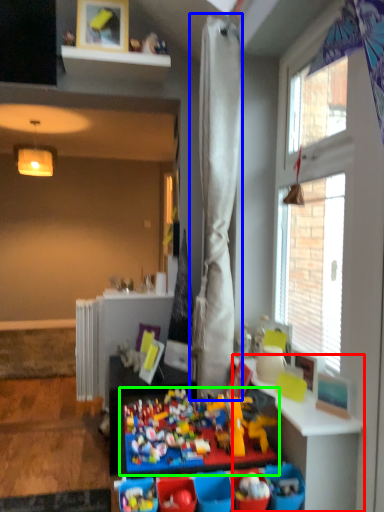
Question: Estimate the real-world distances between objects in this image. Which object is farther from table (highlighted by a red box), curtain (highlighted by a blue box) or toy (highlighted by a green box)?

Choices:
 (A) curtain
 (B) toy

Answer: (A)